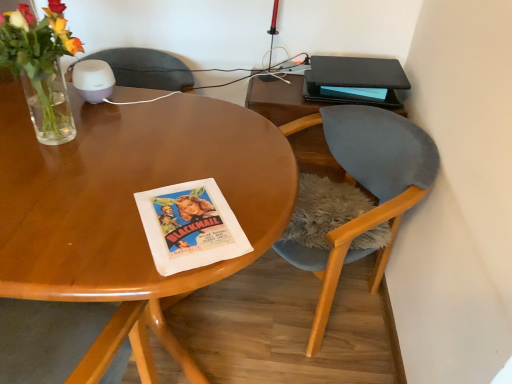
Where is `velvet grey chair at right`? Image resolution: width=512 pixels, height=384 pixels. velvet grey chair at right is located at coordinates (366, 188).

What do you see at coordinates (366, 188) in the screenshot? This screenshot has height=384, width=512. I see `velvet grey chair at right` at bounding box center [366, 188].

What do you see at coordinates (354, 80) in the screenshot?
I see `black matte book at upper right` at bounding box center [354, 80].

What is the approximate width of black matte book at upper right?

It is 10.90 inches.

You are a GUI agent. You are given a task and a screenshot of the screen. Output one action in this format:
    pyautogui.click(x=<x>, y=<y>)
    Task: Click on the black matte book at upper right
    The height and width of the screenshot is (384, 512).
    Given the screenshot: What is the action you would take?
    (354, 80)

At what (x,y) coordinates should I click in order to perform the action: click on velvet grey chair at right. Please return your answer as a coordinate pair (x, y). This screenshot has width=512, height=384. Looking at the image, I should click on (366, 188).

Is black matte book at upper right at the left side of velvet grey chair at right?

Incorrect, black matte book at upper right is not on the left side of velvet grey chair at right.

Consider the image. Which is behind, black matte book at upper right or velvet grey chair at right?

black matte book at upper right is more distant.

Considering the positions of points (329, 77) and (334, 246), is point (329, 77) closer to camera compared to point (334, 246)?

No, (329, 77) is further to viewer.

From the image's perspective, relative to velvet grey chair at right, is black matte book at upper right above or below?

black matte book at upper right is above velvet grey chair at right.

From a real-world perspective, does black matte book at upper right sit lower than velvet grey chair at right?

No.

In the scene shown: Is black matte book at upper right thinner than velvet grey chair at right?

Yes, black matte book at upper right is thinner than velvet grey chair at right.

Who is taller, black matte book at upper right or velvet grey chair at right?

Standing taller between the two is velvet grey chair at right.

Does black matte book at upper right have a smaller size compared to velvet grey chair at right?

Indeed, black matte book at upper right has a smaller size compared to velvet grey chair at right.

Is velvet grey chair at right completely or partially inside black matte book at upper right?

No, velvet grey chair at right is not inside black matte book at upper right.

Is black matte book at upper right directly adjacent to velvet grey chair at right?

No, black matte book at upper right is not next to velvet grey chair at right.

Could you tell me if black matte book at upper right is turned towards velvet grey chair at right?

No.

How different are the orientations of black matte book at upper right and velvet grey chair at right in degrees?

There is a 60.6-degree angle between the facing directions of black matte book at upper right and velvet grey chair at right.

How far apart are black matte book at upper right and velvet grey chair at right?

black matte book at upper right and velvet grey chair at right are 11.27 inches apart from each other.

At what (x,y) coordinates should I click in order to perform the action: click on paperback book lying above the velvet grey chair at right (from the image's perspective). Please return your answer as a coordinate pair (x, y). Image resolution: width=512 pixels, height=384 pixels. Looking at the image, I should click on (354, 80).

Visually, is velvet grey chair at right positioned to the left or to the right of black matte book at upper right?

From the image, it's evident that velvet grey chair at right is to the left of black matte book at upper right.

Is velvet grey chair at right further to the viewer compared to black matte book at upper right?

No, velvet grey chair at right is closer to the viewer.

Which is more distant, (362,140) or (374,85)?

The point (374,85) is behind.

From the image's perspective, is velvet grey chair at right on black matte book at upper right?

No, from the image's perspective, velvet grey chair at right is not over black matte book at upper right.

From a real-world perspective, is velvet grey chair at right on black matte book at upper right?

No, from a real-world perspective, velvet grey chair at right is not above black matte book at upper right.

Consider the image. Can you confirm if velvet grey chair at right is wider than black matte book at upper right?

Indeed, velvet grey chair at right has a greater width compared to black matte book at upper right.

Does velvet grey chair at right have a greater height compared to black matte book at upper right?

Yes.

Can you confirm if velvet grey chair at right is bigger than black matte book at upper right?

Yes.

Is velvet grey chair at right positioned beyond the bounds of black matte book at upper right?

That's correct, velvet grey chair at right is outside of black matte book at upper right.

Is velvet grey chair at right positioned far away from black matte book at upper right?

No, there isn't a large distance between velvet grey chair at right and black matte book at upper right.

Is velvet grey chair at right facing away from black matte book at upper right?

No, velvet grey chair at right is not facing away from black matte book at upper right.

Find the location of a particular element. This screenshot has height=384, width=512. paperback book above the velvet grey chair at right (from the image's perspective) is located at coordinates (354, 80).

The height and width of the screenshot is (384, 512). In order to click on paperback book lying above the velvet grey chair at right (from the image's perspective) in this screenshot , I will do `click(354, 80)`.

I want to click on chair located underneath the black matte book at upper right (from a real-world perspective), so click(366, 188).